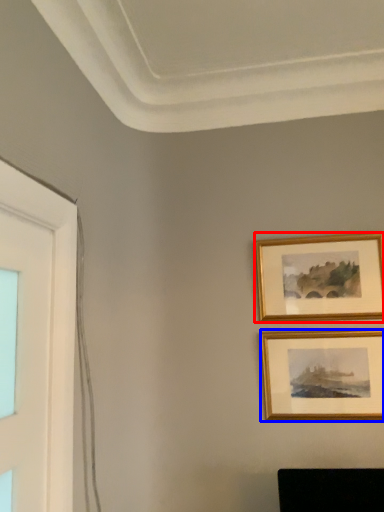
Question: Which object is further to the camera taking this photo, picture frame (highlighted by a red box) or picture frame (highlighted by a blue box)?

Choices:
 (A) picture frame
 (B) picture frame

Answer: (A)